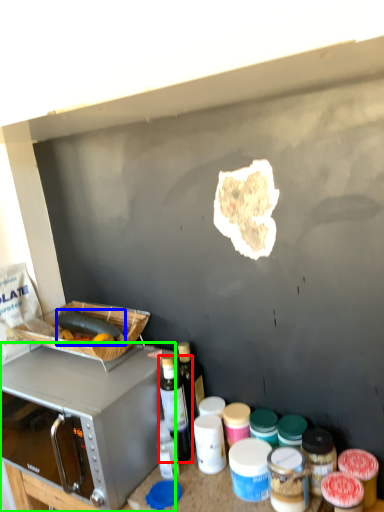
Question: Which object is positioned closest to bottle (highlighted by a red box)? Select from food (highlighted by a blue box) and microwave oven (highlighted by a green box).

Choices:
 (A) food
 (B) microwave oven

Answer: (B)